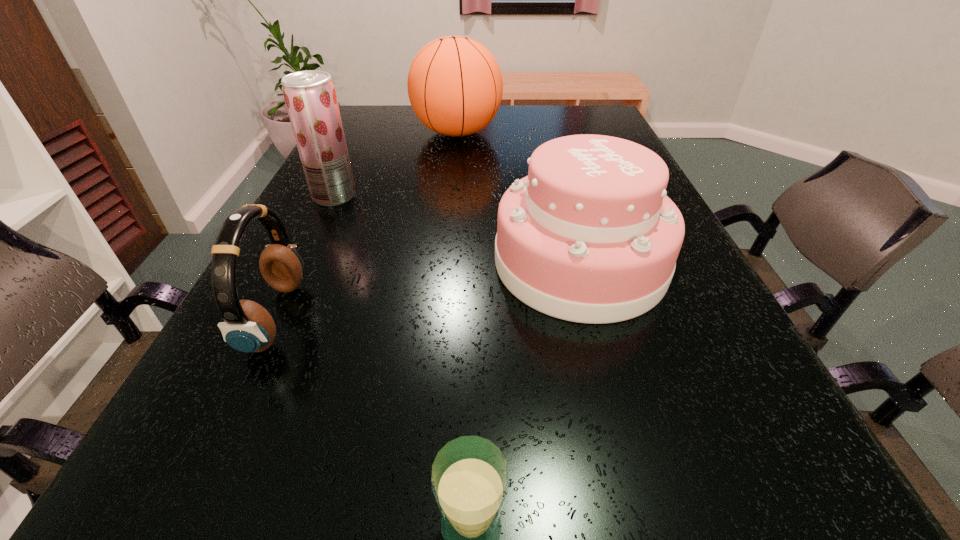
Locate an element on the screen. free spot between the headset and the birthday cake is located at coordinates (428, 289).

Choose which object is the third nearest neighbor to the glass. Please provide its 2D coordinates. Your answer should be formatted as a tuple, i.e. [(x, y)], where the tuple contains the x and y coordinates of a point satisfying the conditions above.

[(310, 97)]

This screenshot has width=960, height=540. Find the location of `the fourth closest object to the birthday cake`. the fourth closest object to the birthday cake is located at coordinates (248, 327).